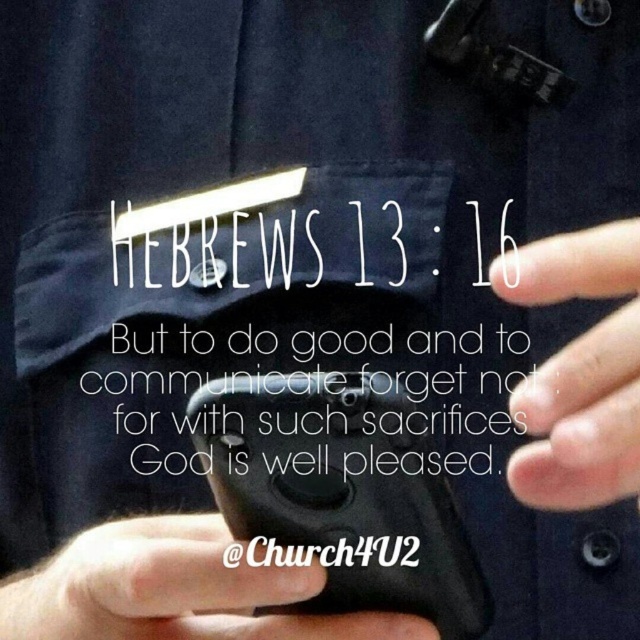
Question: Among these objects, which one is farthest from the camera?

Choices:
 (A) white matte finger at center
 (B) black matte phone at lower center

Answer: (B)

Question: Which point is closer to the camera?

Choices:
 (A) white matte finger at center
 (B) white paper at center
 (C) black matte phone at lower center

Answer: (A)

Question: Which of the following is the farthest from the observer?

Choices:
 (A) (132, 230)
 (B) (536, 493)
 (C) (134, 573)

Answer: (A)

Question: Considering the relative positions of white paper at center and white matte finger at center in the image provided, where is white paper at center located with respect to white matte finger at center?

Choices:
 (A) below
 (B) above

Answer: (A)

Question: Is the position of white paper at center less distant than that of black matte phone at lower center?

Choices:
 (A) no
 (B) yes

Answer: (A)

Question: Observing the image, what is the correct spatial positioning of white paper at center in reference to white matte finger at center?

Choices:
 (A) above
 (B) below

Answer: (B)